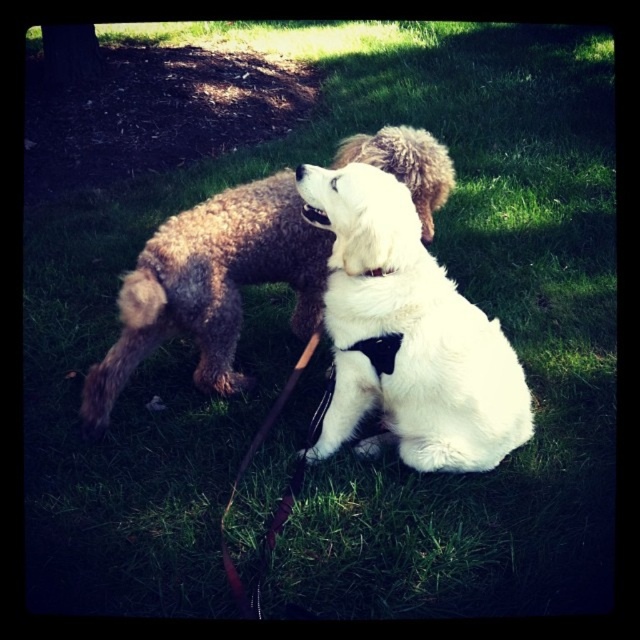
Question: Can you confirm if fluffy brown dog at center is smaller than black leather neckband at center?

Choices:
 (A) yes
 (B) no

Answer: (B)

Question: Does white soft fur dog at center appear on the right side of fluffy brown dog at center?

Choices:
 (A) yes
 (B) no

Answer: (A)

Question: Among these points, which one is farthest from the camera?

Choices:
 (A) (365, 273)
 (B) (376, 348)

Answer: (B)

Question: Which point is farther to the camera?

Choices:
 (A) black fabric neckband at center
 (B) black leather neckband at center

Answer: (A)

Question: Can you confirm if fluffy brown dog at center is wider than leather at center?

Choices:
 (A) yes
 (B) no

Answer: (A)

Question: Estimate the real-world distances between objects in this image. Which object is closer to the black fabric neckband at center?

Choices:
 (A) white soft fur dog at center
 (B) white fluffy dog at center

Answer: (A)